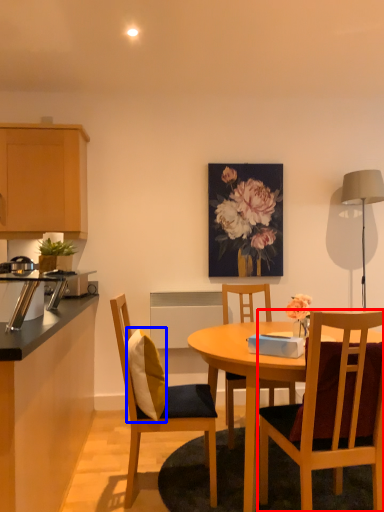
Question: Which object is closer to the camera taking this photo, chair (highlighted by a red box) or pillow (highlighted by a blue box)?

Choices:
 (A) chair
 (B) pillow

Answer: (A)